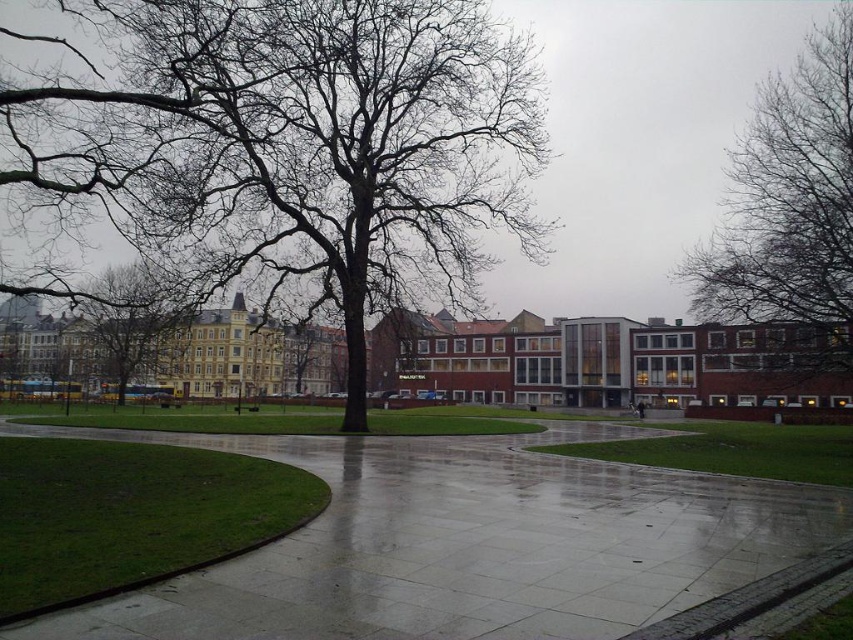
Is glossy concrete pavement at center closer to the viewer compared to brown bark tree at left?

That is True.

Can you confirm if glossy concrete pavement at center is wider than brown bark tree at left?

In fact, glossy concrete pavement at center might be narrower than brown bark tree at left.

Find the location of a particular element. glossy concrete pavement at center is located at coordinates click(471, 544).

Does bare branches at center have a lesser width compared to brown bark tree at left?

Yes.

Is bare branches at center smaller than brown bark tree at left?

Yes, bare branches at center is smaller than brown bark tree at left.

Who is more forward, (526, 237) or (126, 339)?

Point (526, 237) is in front.

Identify the location of bare branches at center. (309, 147).

Who is higher up, bare branches at center or bare branches at upper right?

bare branches at upper right is higher up.

Based on the photo, is bare branches at center above bare branches at upper right?

Incorrect, bare branches at center is not positioned above bare branches at upper right.

Where is `bare branches at center`? The height and width of the screenshot is (640, 853). bare branches at center is located at coordinates (309, 147).